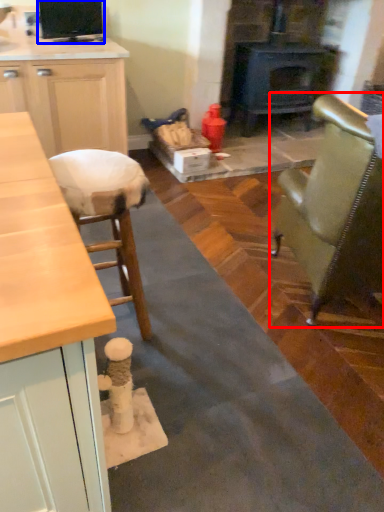
Question: Which point is further to the camera, chair (highlighted by a red box) or appliance (highlighted by a blue box)?

Choices:
 (A) chair
 (B) appliance

Answer: (B)